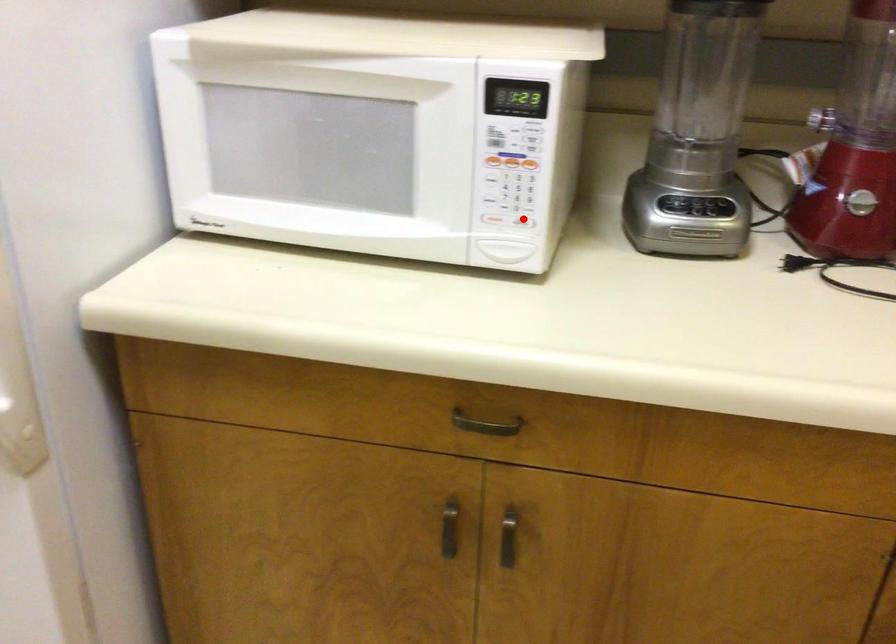
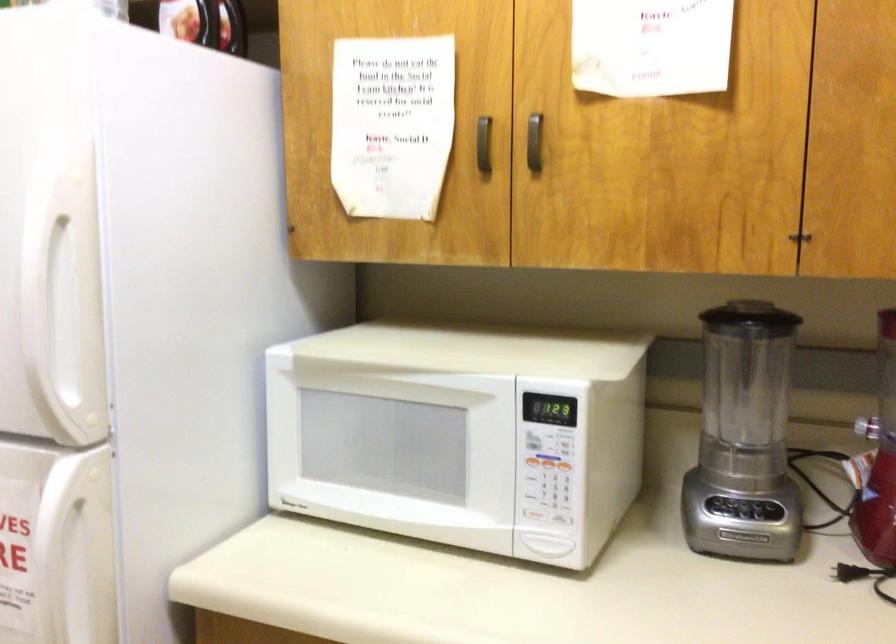
Locate, in the second image, the point that corresponds to the highlighted location in the first image.

(563, 518)